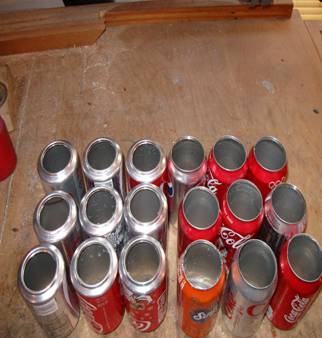
Where is `baseboard`? The height and width of the screenshot is (338, 322). baseboard is located at coordinates (64, 25).